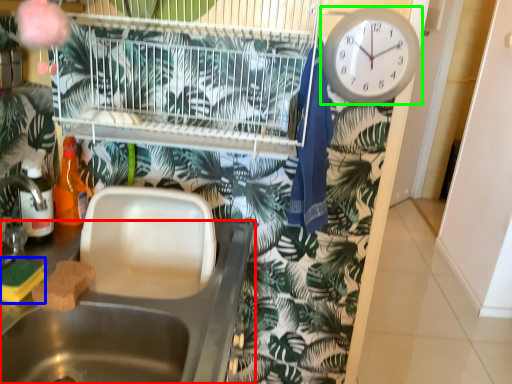
Question: Which is farther away from sink (highlighted by a red box)? food (highlighted by a blue box) or wall clock (highlighted by a green box)?

Choices:
 (A) food
 (B) wall clock

Answer: (B)